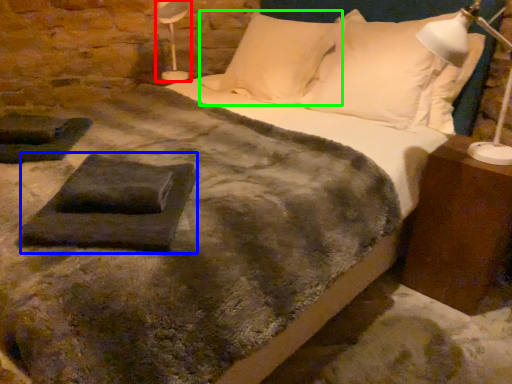
Question: Which object is the closest to the table lamp (highlighted by a red box)? Choose among these: slate (highlighted by a blue box) or pillow (highlighted by a green box).

Choices:
 (A) slate
 (B) pillow

Answer: (B)